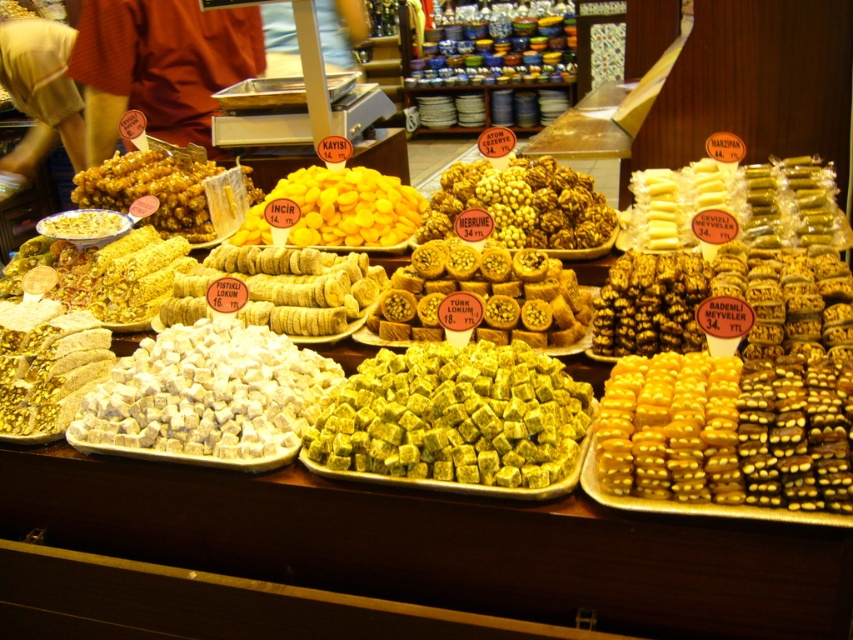
You are a customer at the Turkish sweets shop. You want to buy the yellow crumbly pastry at center. The shopkeeper tells you that the pastry is located at point coordinates of (280, 289). Can you confirm if this point corresponds to the yellow crumbly pastry at center?

Yes, the yellow crumbly pastry at center is represented by point coordinates of (280, 289).

You are a customer at the Turkish sweets shop and want to locate the golden textured nuts at center and the golden crunchy pastry at center. According to their positions, which one is situated more to the right?

The golden textured nuts at center are to the right of the golden crunchy pastry at center, so the golden textured nuts at center is situated more to the right.